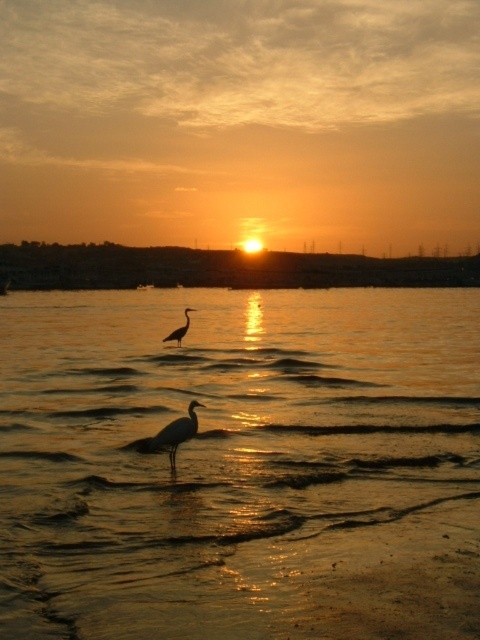
Based on the photo, you are a photographer trying to capture the sunset scene. You notice the golden reflective water at center and the matte gray bird at center. Which object is positioned higher in the image?

The golden reflective water at center is taller than the matte gray bird at center, so the golden reflective water at center is positioned higher in the image.

You are an ornithologist observing two birds in the sunset scene. You notice that the matte gray bird at center and the silvery white bird at center are both facing the same direction. Which bird has a wider silhouette when viewed from your perspective?

The matte gray bird at center has a wider silhouette than the silvery white bird at center because its width is larger, as described.

You are a photographer trying to capture the sunset scene. You notice the matte gray bird at center in the image. Where would you position the bird in your camera frame to ensure it aligns with the rule of thirds grid? Please provide coordinates based on the grid intersections.

According to the rule of thirds grid, the intersections are at approximately [479,639], [479,639], [479,639], [479,639], [479,639], [479,639], [479,639], [479,639], [479,639], [479,639], [479,639], [479,639], [479,639], [479,639], [479,639], [479,639], [479,639], [479,639], [479,639], [479,639], [479,639], [479,639], [479,639], [479,639], [479,639], [479,639], [479,639], [479,639], [479,639], [479,639], [479,639], [479,639], [479,639], [479,639], [479,639], [479,639], [479,639]